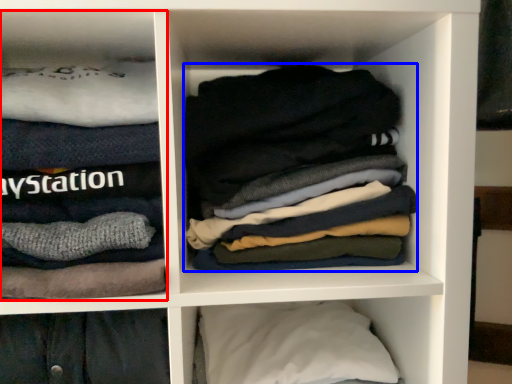
Question: Which point is closer to the camera, cabinet (highlighted by a red box) or laundry (highlighted by a blue box)?

Choices:
 (A) cabinet
 (B) laundry

Answer: (A)